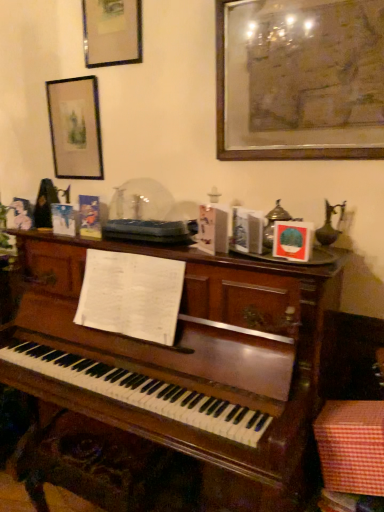
Question: Could you tell me if wooden framed artwork at upper right, the first picture frame viewed from the right, is facing checkered fabric box at lower right?

Choices:
 (A) no
 (B) yes

Answer: (A)

Question: Is wooden framed artwork at upper right, marked as the 3th picture frame in a left-to-right arrangement, touching checkered fabric box at lower right?

Choices:
 (A) no
 (B) yes

Answer: (A)

Question: Can you confirm if wooden framed artwork at upper right, the 1th picture frame from the front, is wider than checkered fabric box at lower right?

Choices:
 (A) yes
 (B) no

Answer: (B)

Question: Is wooden framed artwork at upper right, marked as the 3th picture frame in a left-to-right arrangement, thinner than checkered fabric box at lower right?

Choices:
 (A) no
 (B) yes

Answer: (B)

Question: Considering the relative sizes of wooden framed artwork at upper right, marked as the 3th picture frame in a left-to-right arrangement, and checkered fabric box at lower right in the image provided, is wooden framed artwork at upper right, marked as the 3th picture frame in a left-to-right arrangement, bigger than checkered fabric box at lower right?

Choices:
 (A) no
 (B) yes

Answer: (B)

Question: Is wooden framed artwork at upper right, marked as the 3th picture frame in a left-to-right arrangement, further to the viewer compared to checkered fabric box at lower right?

Choices:
 (A) yes
 (B) no

Answer: (A)

Question: Is the position of wooden framed artwork at upper right, the 1th picture frame from the front, less distant than that of matte black picture frame at upper left, arranged as the second picture frame when viewed from the back?

Choices:
 (A) no
 (B) yes

Answer: (B)

Question: Would you say wooden framed artwork at upper right, marked as the third picture frame in a back-to-front arrangement, contains matte black picture frame at upper left, arranged as the second picture frame when viewed from the back?

Choices:
 (A) yes
 (B) no

Answer: (B)

Question: Is wooden framed artwork at upper right, marked as the 3th picture frame in a left-to-right arrangement, with matte black picture frame at upper left, arranged as the 2th picture frame when viewed from the right?

Choices:
 (A) no
 (B) yes

Answer: (A)

Question: Does wooden framed artwork at upper right, the 1th picture frame from the front, have a lesser height compared to matte black picture frame at upper left, which ranks as the 2th picture frame in left-to-right order?

Choices:
 (A) no
 (B) yes

Answer: (A)

Question: Is wooden framed artwork at upper right, the 1th picture frame from the front, aimed at matte black picture frame at upper left, arranged as the second picture frame when viewed from the back?

Choices:
 (A) no
 (B) yes

Answer: (A)

Question: From a real-world perspective, is wooden framed artwork at upper right, marked as the third picture frame in a back-to-front arrangement, on top of matte black picture frame at upper left, arranged as the 2th picture frame when viewed from the right?

Choices:
 (A) no
 (B) yes

Answer: (A)

Question: Are matte black picture frame at upper left, acting as the 3th picture frame starting from the right, and checkered fabric box at lower right beside each other?

Choices:
 (A) no
 (B) yes

Answer: (A)